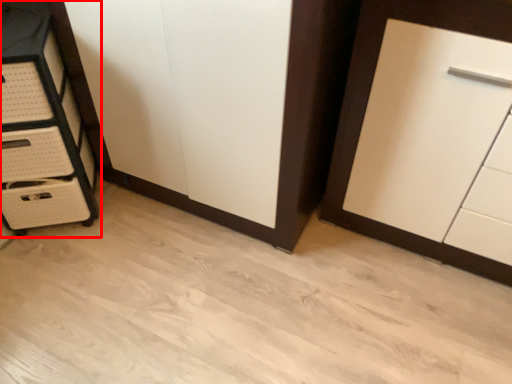
Question: Where is chest of drawers (annotated by the red box) located in relation to cupboard in the image?

Choices:
 (A) right
 (B) left

Answer: (B)